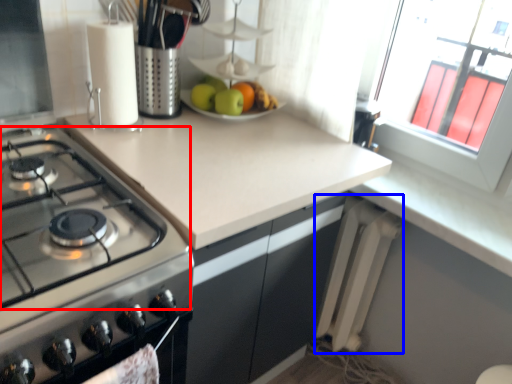
Question: Among these objects, which one is farthest to the camera, gas stove (highlighted by a red box) or radiator (highlighted by a blue box)?

Choices:
 (A) gas stove
 (B) radiator

Answer: (B)